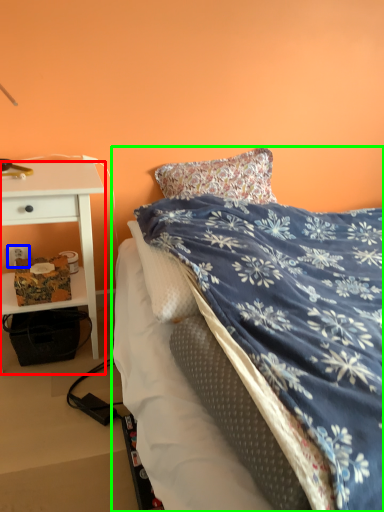
Question: Which object is positioned farthest from desk (highlighted by a red box)? Select from power outlet (highlighted by a blue box) and bed (highlighted by a green box).

Choices:
 (A) power outlet
 (B) bed

Answer: (B)